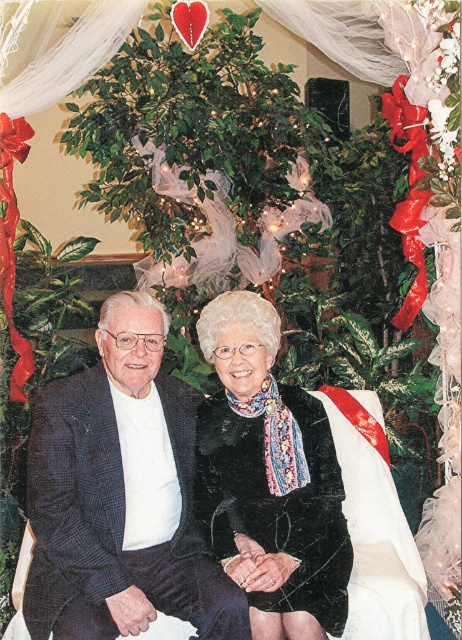
You are a photographer planning to take a portrait of the couple in the scene. You need to ensure that both the dark blue textured suit at center and the black textured scarf at center are clearly visible in the frame. Given their sizes, which item should you focus on to ensure both are in focus?

The dark blue textured suit at center is bigger than the black textured scarf at center. To ensure both are in focus, you should focus on the dark blue textured suit at center since it is larger and will require more attention to detail.

Consider the image. You are a photographer setting up a camera to capture the scene. You need to ensure that both the dark blue textured suit at center and the black textured scarf at center are fully visible in the frame. Based on their sizes, which object requires more space in the composition?

The dark blue textured suit at center might be wider than the black textured scarf at center, so it requires more space in the composition to ensure it is fully visible.

You are a photographer trying to capture a closeup shot of both the dark blue textured suit at center and the black textured scarf at center in the scene. The camera you are using has a maximum focus range of 8 inches. Will you be able to capture both items in focus without adjusting the camera settings?

The dark blue textured suit at center and black textured scarf at center are 8.75 inches apart from each other, which exceeds the camera maximum focus range of 8 inches. Therefore, you cannot capture both items in focus without adjusting the camera settings.